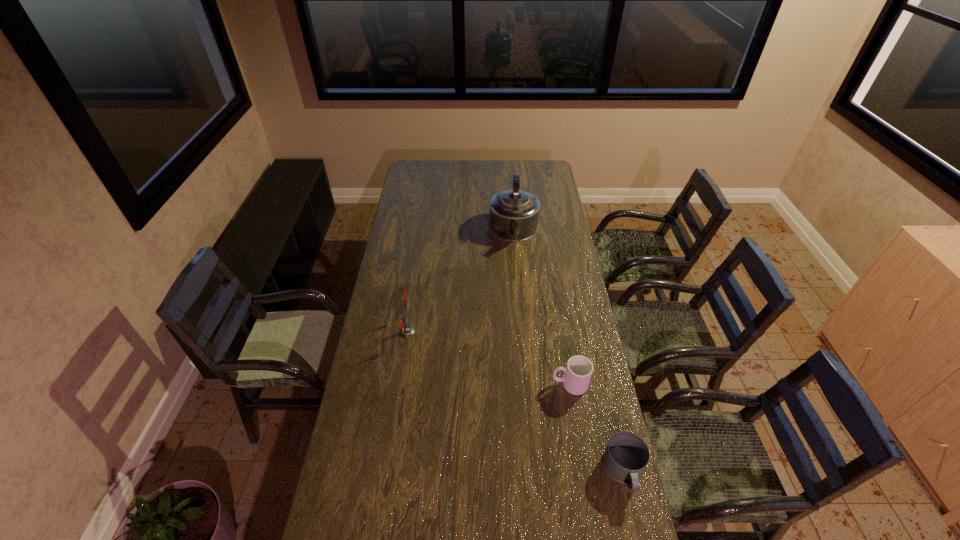
Locate an element on the screen. the leftmost object is located at coordinates (405, 331).

Locate an element on the screen. The height and width of the screenshot is (540, 960). candle is located at coordinates (405, 331).

The image size is (960, 540). Identify the location of the nearest object. (626, 456).

Where is `the shortest object`? The height and width of the screenshot is (540, 960). the shortest object is located at coordinates (626, 456).

At what (x,y) coordinates should I click in order to perform the action: click on kettle. Please return your answer as a coordinate pair (x, y). The image size is (960, 540). Looking at the image, I should click on (513, 214).

Where is `the tallest object`? Image resolution: width=960 pixels, height=540 pixels. the tallest object is located at coordinates (513, 214).

This screenshot has height=540, width=960. What are the coordinates of `cup` in the screenshot? It's located at (578, 371).

Where is `the second nearest object`? The image size is (960, 540). the second nearest object is located at coordinates (578, 371).

Locate an element on the screen. The image size is (960, 540). free region located on the front-facing side of the leftmost object is located at coordinates click(384, 331).

Locate an element on the screen. This screenshot has height=540, width=960. free space located 0.190m with the spout at the front of the tallest object is located at coordinates (515, 279).